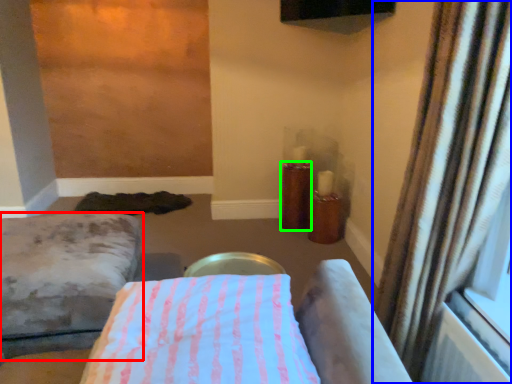
Question: Considering the real-world distances, which object is farthest from furniture (highlighted by a red box)? curtain (highlighted by a blue box) or candle holder (highlighted by a green box)?

Choices:
 (A) curtain
 (B) candle holder

Answer: (B)